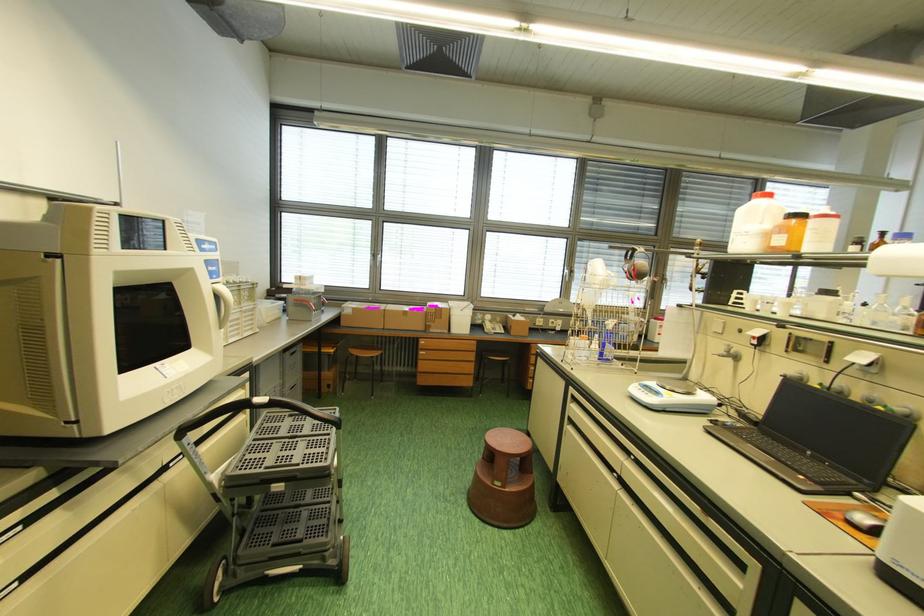
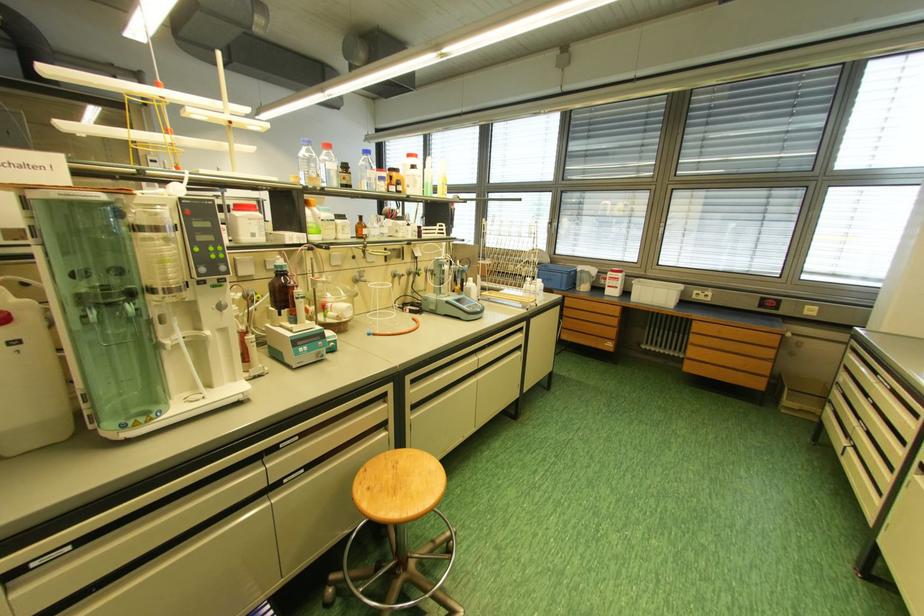
Question: I am providing you with two images of the same scene from different viewpoints. After the viewpoint changes to image2, which objects are now occluded?

Choices:
 (A) amber glass bottle
 (B) silver desk bell
 (C) blue plastic box
 (D) white machine handle

Answer: (D)